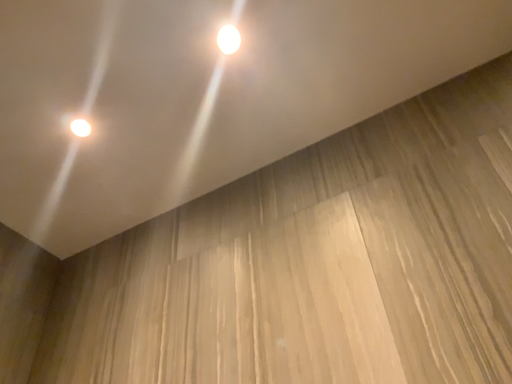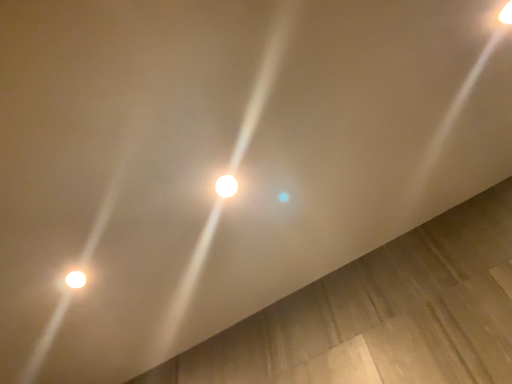
Question: How did the camera likely rotate when shooting the video?

Choices:
 (A) rotated downward
 (B) rotated upward

Answer: (B)